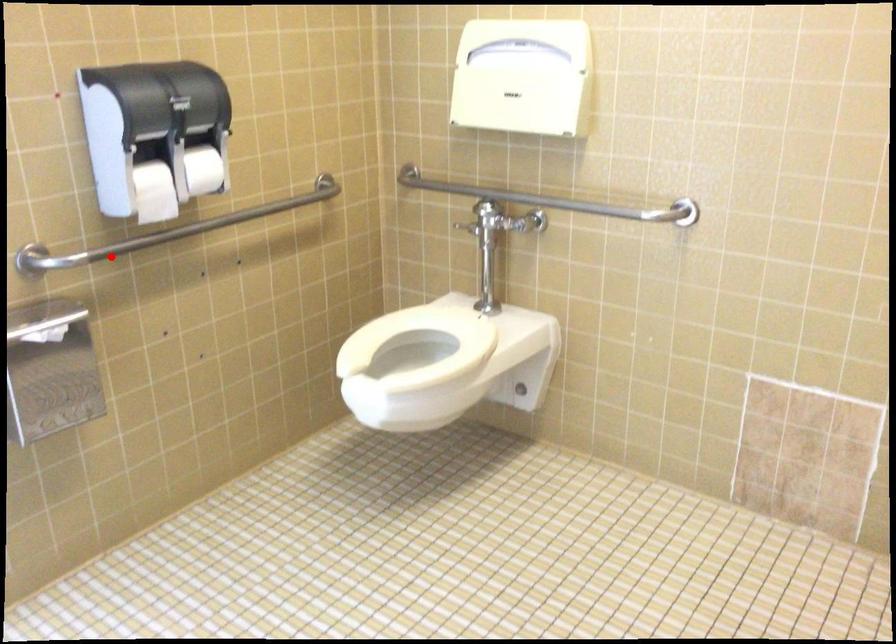
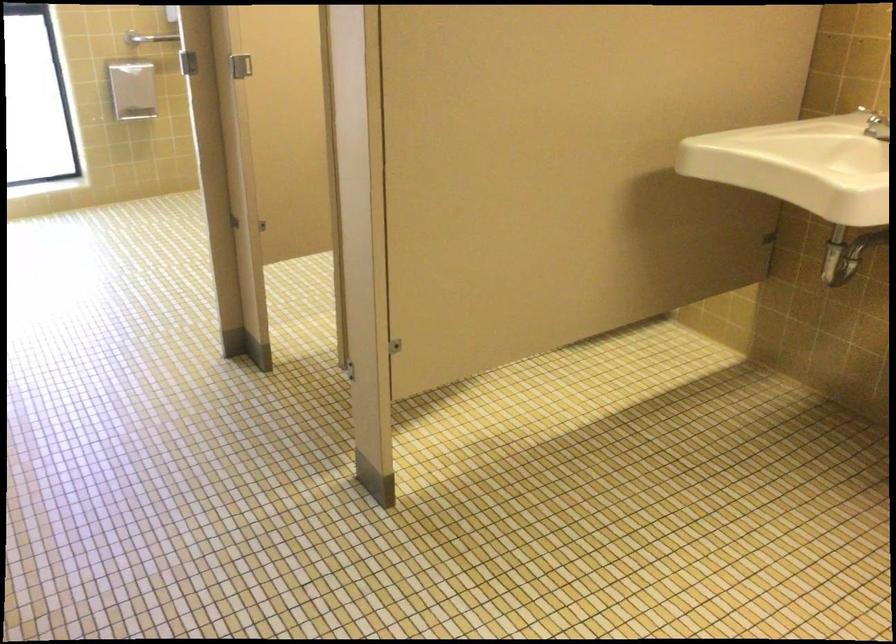
Question: I am providing you with two images of the same scene from different viewpoints. Given a red point in image1, look at the same physical point in image2. Is it:

Choices:
 (A) Closer to the viewpoint
 (B) Farther from the viewpoint

Answer: (B)